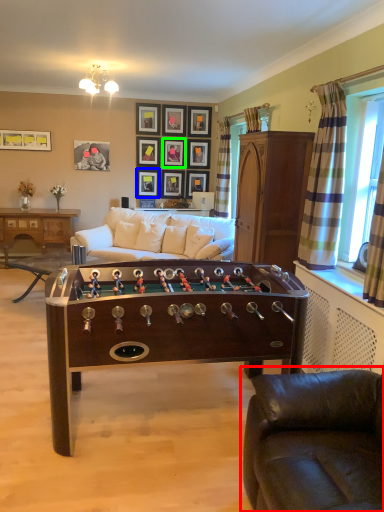
Question: Which object is positioned closest to studio couch (highlighted by a red box)? Select from picture frame (highlighted by a blue box) and picture frame (highlighted by a green box).

Choices:
 (A) picture frame
 (B) picture frame

Answer: (A)